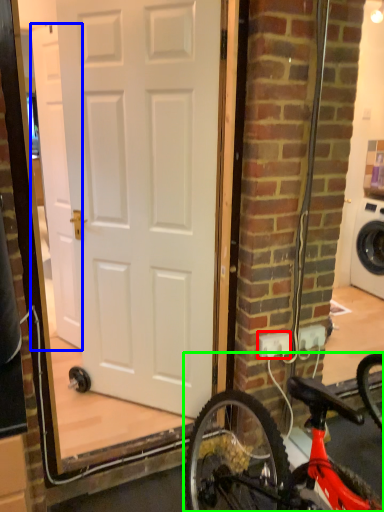
Question: Which object is the closest to the electric outlet (highlighted by a red box)? Choose among these: door (highlighted by a blue box) or bicycle (highlighted by a green box).

Choices:
 (A) door
 (B) bicycle

Answer: (B)